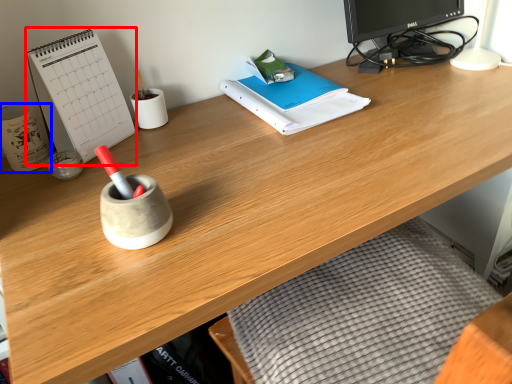
Question: Among these objects, which one is farthest to the camera, paperback book (highlighted by a red box) or stationery (highlighted by a blue box)?

Choices:
 (A) paperback book
 (B) stationery

Answer: (B)